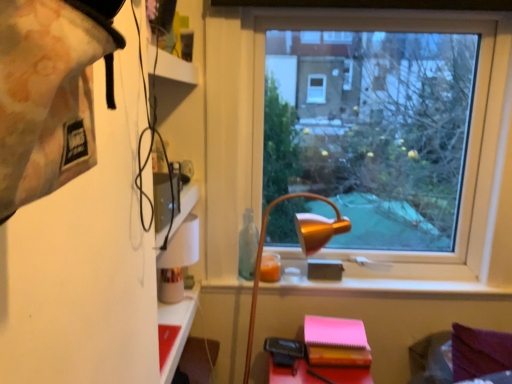
Where is `vacant space in transparent glass window at center (from a real-world perspective)`? The height and width of the screenshot is (384, 512). vacant space in transparent glass window at center (from a real-world perspective) is located at coordinates (376, 276).